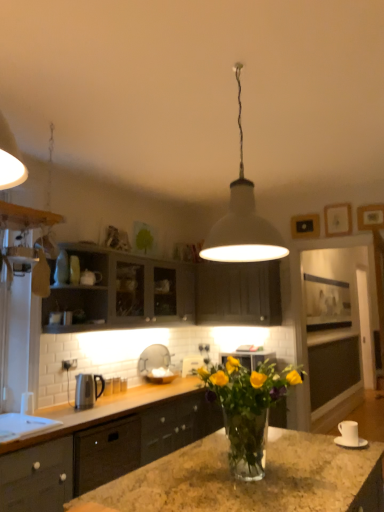
Question: Is matte gray cabinets at upper left, positioned as the 1th cabinetry in top-to-bottom order, wider or thinner than white ceramic cup at lower right, which appears as the first appliance when viewed from the front?

Choices:
 (A) thin
 (B) wide

Answer: (B)

Question: Choose the correct answer: Is matte gray cabinets at upper left, placed as the third cabinetry when sorted from bottom to top, inside white ceramic cup at lower right, acting as the 1th appliance starting from the right, or outside it?

Choices:
 (A) inside
 (B) outside

Answer: (B)

Question: Estimate the real-world distances between objects in this image. Which object is closer to the matte black cabinets at center, marked as the third cabinetry in a top-to-bottom arrangement?

Choices:
 (A) white ceramic cup at lower right, acting as the 1th appliance starting from the right
 (B) matte gray cabinets at upper left, placed as the third cabinetry when sorted from bottom to top
 (C) white glossy sink at center
 (D) translucent glass vase at center
 (E) white matte pendant light at center

Answer: (C)

Question: Estimate the real-world distances between objects in this image. Which object is closer to the matte black cabinets at center, which is the first cabinetry from bottom to top?

Choices:
 (A) matte dark gray cabinet at center, which is counted as the 2th cabinetry, starting from the bottom
 (B) white matte pendant light at center
 (C) white glossy plate at upper center, which is counted as the 1th appliance, starting from the back
 (D) white glossy sink at center
 (E) white ceramic cup at lower right, which appears as the first appliance when viewed from the front

Answer: (D)